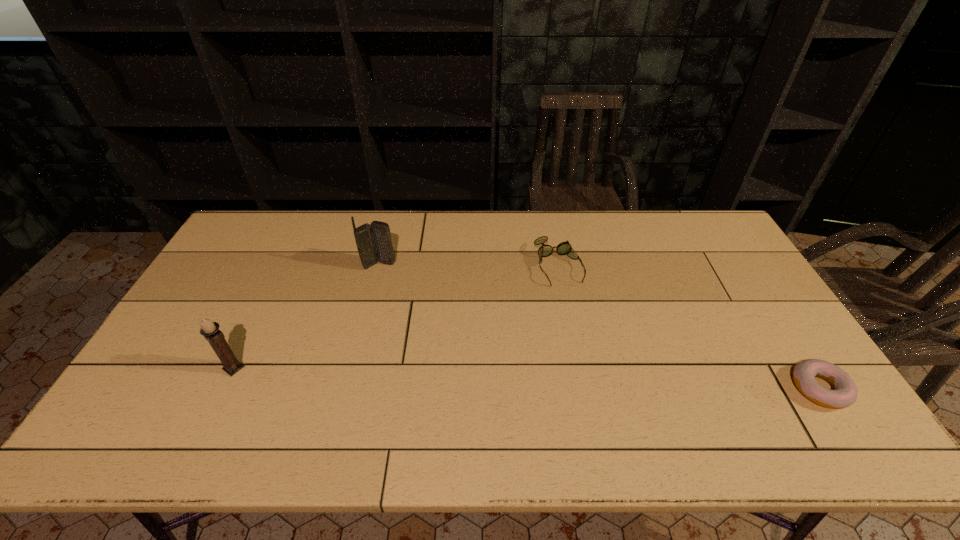
The width and height of the screenshot is (960, 540). What are the coordinates of `candle holder` in the screenshot? It's located at (210, 330).

Where is `the rightmost object`? This screenshot has height=540, width=960. the rightmost object is located at coordinates (845, 392).

Image resolution: width=960 pixels, height=540 pixels. Find the location of `doughnut`. doughnut is located at coordinates (845, 392).

The image size is (960, 540). What are the coordinates of `cellular telephone` in the screenshot? It's located at (373, 241).

Where is `spectacles`? spectacles is located at coordinates (564, 248).

Locate an element on the screen. the second object from right to left is located at coordinates (564, 248).

Where is `vacant space positioned on the right of the leftmost object`? The width and height of the screenshot is (960, 540). vacant space positioned on the right of the leftmost object is located at coordinates (373, 368).

Locate an element on the screen. blank space located 0.210m on the back of the shortest object is located at coordinates (767, 308).

Locate an element on the screen. vacant area located on the keyboard of the cellular telephone is located at coordinates (441, 308).

Locate an element on the screen. The image size is (960, 540). free space located on the keyboard of the cellular telephone is located at coordinates [x=447, y=314].